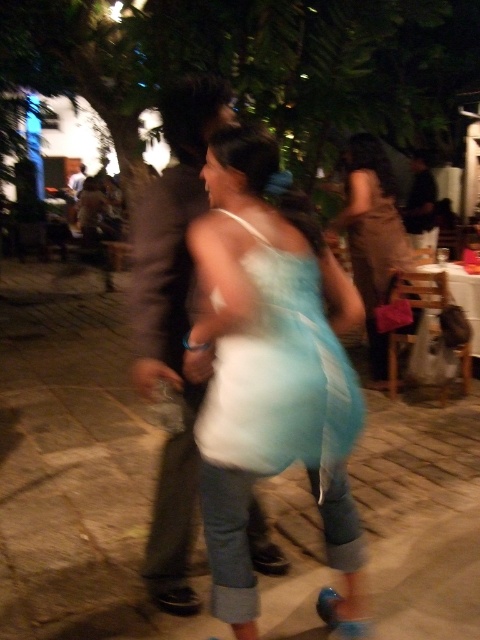
You are at a party and see two people dancing at the center wearing the light blue satin dress at center and the matte brown dress at center. Which one is positioned more to the left side?

The light blue satin dress at center is positioned more to the left side.

You are at a party and want to know which clothing item takes up more space horizontally between the dark brown suit at center and the light blue satin dress at center. Which one is wider?

The light blue satin dress at center is wider than the dark brown suit at center.

You are a photographer at the event and want to capture both the light blue satin dress at center and the matte brown dress at center in a single shot. Which dress should you focus on first to ensure both are in frame?

The light blue satin dress at center is positioned under the matte brown dress at center, so focusing on the matte brown dress at center first will ensure both are in frame.